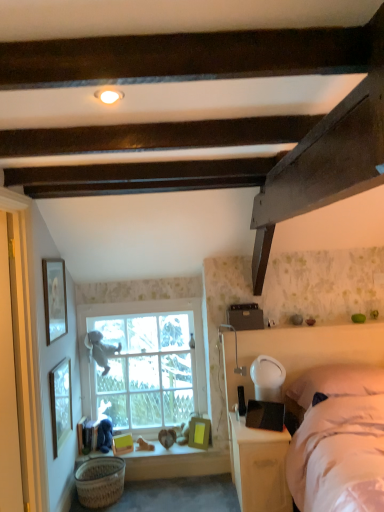
What do you see at coordinates (60, 403) in the screenshot? I see `wooden picture frame at left, which ranks as the second picture frame in left-to-right order` at bounding box center [60, 403].

This screenshot has height=512, width=384. Describe the element at coordinates (100, 481) in the screenshot. I see `woven brown basket at lower left` at that location.

Image resolution: width=384 pixels, height=512 pixels. Find the location of `woven brown basket at lower left`. woven brown basket at lower left is located at coordinates (100, 481).

Find the location of a particular element. The image size is (384, 512). matte gold picture frame at lower center, the first picture frame in the right-to-left sequence is located at coordinates (199, 433).

Measure the distance between point (197, 446) and camera.

Point (197, 446) and camera are 3.28 meters apart.

This screenshot has height=512, width=384. What do you see at coordinates (54, 298) in the screenshot? I see `matte white picture frame at upper left, the first picture frame positioned from the left` at bounding box center [54, 298].

Identify the location of wooden picture frame at left, arranged as the 2th picture frame when viewed from the top. (60, 403).

Is gray plush toy at window, which is the second person in bottom-to-top order, far away from wooden picture frame at lower left, the third picture frame from the left?

gray plush toy at window, which is the second person in bottom-to-top order, is near wooden picture frame at lower left, the third picture frame from the left, not far away.

Can you confirm if gray plush toy at window, which is the second person in bottom-to-top order, is shorter than wooden picture frame at lower left, which is the third picture frame in right-to-left order?

No.

Considering the relative sizes of gray plush toy at window, which is the second person in bottom-to-top order, and wooden picture frame at lower left, which is the third picture frame in right-to-left order, in the image provided, is gray plush toy at window, which is the second person in bottom-to-top order, thinner than wooden picture frame at lower left, which is the third picture frame in right-to-left order,?

Yes.

Could you tell me if white glossy nightstand at lower right is turned towards gray plush toy at window, positioned as the first person in top-to-bottom order?

No, white glossy nightstand at lower right does not turn towards gray plush toy at window, positioned as the first person in top-to-bottom order.

The image size is (384, 512). What are the coordinates of `the 2nd person to the left of the white glossy nightstand at lower right, counting from the anchor's position` in the screenshot? It's located at (100, 350).

Is white glossy nightstand at lower right inside or outside of gray plush toy at window, positioned as the first person in top-to-bottom order?

white glossy nightstand at lower right is not inside gray plush toy at window, positioned as the first person in top-to-bottom order, it's outside.

Is white glossy nightstand at lower right positioned behind gray plush toy at window, which is the second person in bottom-to-top order?

No, the depth of white glossy nightstand at lower right is less than that of gray plush toy at window, which is the second person in bottom-to-top order.

Is white soft pillow at right looking in the opposite direction of wooden picture frame at left, arranged as the 2th picture frame when viewed from the top?

white soft pillow at right is not turned away from wooden picture frame at left, arranged as the 2th picture frame when viewed from the top.

From the image's perspective, is white soft pillow at right positioned above or below wooden picture frame at left, which ranks as the second picture frame in left-to-right order?

Clearly, from the image's perspective, white soft pillow at right is above wooden picture frame at left, which ranks as the second picture frame in left-to-right order.

Looking at their sizes, would you say white soft pillow at right is wider or thinner than wooden picture frame at left, which ranks as the second picture frame in left-to-right order?

Clearly, white soft pillow at right has more width compared to wooden picture frame at left, which ranks as the second picture frame in left-to-right order.

This screenshot has height=512, width=384. I want to click on pillow on the right of wooden picture frame at left, which ranks as the second picture frame in left-to-right order, so click(x=336, y=382).

Can you confirm if matte white picture frame at upper left, acting as the 1th picture frame starting from the top, is positioned to the left of velvety blue teddy bear at lower left, the first person in the bottom-to-top sequence?

Indeed, matte white picture frame at upper left, acting as the 1th picture frame starting from the top, is positioned on the left side of velvety blue teddy bear at lower left, the first person in the bottom-to-top sequence.

Are matte white picture frame at upper left, the first picture frame positioned from the left, and velvety blue teddy bear at lower left, which ranks as the second person in top-to-bottom order, making contact?

matte white picture frame at upper left, the first picture frame positioned from the left, and velvety blue teddy bear at lower left, which ranks as the second person in top-to-bottom order, are clearly separated.

Which object is more forward, matte white picture frame at upper left, acting as the 1th picture frame starting from the top, or velvety blue teddy bear at lower left, the first person in the bottom-to-top sequence?

matte white picture frame at upper left, acting as the 1th picture frame starting from the top.

Between wooden picture frame at lower left, placed as the fourth picture frame when sorted from top to bottom, and white fabric bed at right, which one appears on the right side from the viewer's perspective?

From the viewer's perspective, white fabric bed at right appears more on the right side.

Is wooden picture frame at lower left, acting as the 2th picture frame starting from the bottom, with white fabric bed at right?

No, wooden picture frame at lower left, acting as the 2th picture frame starting from the bottom, is not next to white fabric bed at right.

Locate an element on the screen. This screenshot has height=512, width=384. the 3rd picture frame behind the white fabric bed at right is located at coordinates (81, 433).

Which of these two, wooden picture frame at lower left, placed as the fourth picture frame when sorted from top to bottom, or white fabric bed at right, is smaller?

With smaller size is wooden picture frame at lower left, placed as the fourth picture frame when sorted from top to bottom.

Identify the location of person located below the white glossy nightstand at lower right (from the image's perspective). Image resolution: width=384 pixels, height=512 pixels. pos(104,433).

Is white glossy nightstand at lower right oriented away from velvety blue teddy bear at lower left, the first person in the bottom-to-top sequence?

No, white glossy nightstand at lower right is not facing the opposite direction of velvety blue teddy bear at lower left, the first person in the bottom-to-top sequence.

From the image's perspective, is white glossy nightstand at lower right located above or below velvety blue teddy bear at lower left, which ranks as the second person in top-to-bottom order?

From the image's perspective, white glossy nightstand at lower right appears above velvety blue teddy bear at lower left, which ranks as the second person in top-to-bottom order.

Does point (289, 494) come farther from viewer compared to point (304, 408)?

No.

Does white glossy nightstand at lower right have a lesser width compared to white soft pillow at right?

No.

Is white glossy nightstand at lower right positioned before white soft pillow at right?

That is True.

Is white glossy nightstand at lower right far from white soft pillow at right?

No, white glossy nightstand at lower right is not far away from white soft pillow at right.

Where is `the 2nd person behind the wooden picture frame at lower left, placed as the fourth picture frame when sorted from top to bottom`? the 2nd person behind the wooden picture frame at lower left, placed as the fourth picture frame when sorted from top to bottom is located at coordinates (100, 350).

At what (x,y) coordinates should I click in order to perform the action: click on nightstand that appears below the gray plush toy at window, which is the second person in bottom-to-top order (from a real-world perspective). Please return your answer as a coordinate pair (x, y). This screenshot has width=384, height=512. Looking at the image, I should click on (259, 467).

Considering their positions, is matte gold picture frame at lower center, the first picture frame in the right-to-left sequence, positioned closer to gray plush toy at window, which is the second person in bottom-to-top order, than wooden picture frame at left, the fourth picture frame viewed from the right?

Among the two, wooden picture frame at left, the fourth picture frame viewed from the right, is located nearer to gray plush toy at window, which is the second person in bottom-to-top order.

When comparing their distances from matte gold picture frame at lower center, the first picture frame in the right-to-left sequence, does matte white picture frame at upper left, which is the fifth picture frame from right to left, or white fabric bed at right seem further?

matte white picture frame at upper left, which is the fifth picture frame from right to left, is positioned further to the anchor matte gold picture frame at lower center, the first picture frame in the right-to-left sequence.

Looking at the image, which one is located closer to matte white picture frame at upper left, which is the fifth picture frame from right to left, white glossy nightstand at lower right or wooden picture frame at lower left, placed as the fourth picture frame when sorted from top to bottom?

wooden picture frame at lower left, placed as the fourth picture frame when sorted from top to bottom, is positioned closer to the anchor matte white picture frame at upper left, which is the fifth picture frame from right to left.

Based on their spatial positions, is woven brown basket at lower left or clear glass window at center further from gray plush toy at window, positioned as the first person in top-to-bottom order?

woven brown basket at lower left is positioned further to the anchor gray plush toy at window, positioned as the first person in top-to-bottom order.

From the image, which object appears to be nearer to wooden window sill at lower center, clear glass window at center or matte white picture frame at upper left, which is the fifth picture frame from right to left?

clear glass window at center.

Looking at this image, from the image, which object appears to be nearer to yellow matte picture frame at lower center, arranged as the second picture frame when viewed from the right, white soft pillow at right or white fabric bed at right?

white fabric bed at right is positioned closer to the anchor yellow matte picture frame at lower center, arranged as the second picture frame when viewed from the right.

Considering their positions, is matte white picture frame at upper left, acting as the 1th picture frame starting from the top, positioned further to clear glass window at center than matte gold picture frame at lower center, the first picture frame in the right-to-left sequence?

matte white picture frame at upper left, acting as the 1th picture frame starting from the top.

Based on their spatial positions, is wooden window sill at lower center or woven brown basket at lower left further from white soft pillow at right?

The object further to white soft pillow at right is woven brown basket at lower left.

In order to click on nightstand between gray plush toy at window, positioned as the first person in top-to-bottom order, and white fabric bed at right, in the horizontal direction in this screenshot , I will do `click(259, 467)`.

This screenshot has width=384, height=512. Identify the location of nightstand located between matte white picture frame at upper left, acting as the 1th picture frame starting from the top, and white soft pillow at right in the left-right direction. (259, 467).

Find the location of a particular element. nightstand between wooden window sill at lower center and white fabric bed at right in the horizontal direction is located at coordinates (259, 467).

The height and width of the screenshot is (512, 384). Find the location of `window sill that lies between clear glass window at center and woven brown basket at lower left from top to bottom`. window sill that lies between clear glass window at center and woven brown basket at lower left from top to bottom is located at coordinates (177, 455).